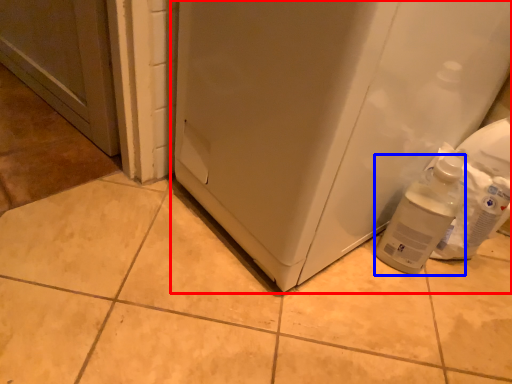
Question: Which point is further to the camera, refrigerator (highlighted by a red box) or bottle (highlighted by a blue box)?

Choices:
 (A) refrigerator
 (B) bottle

Answer: (B)